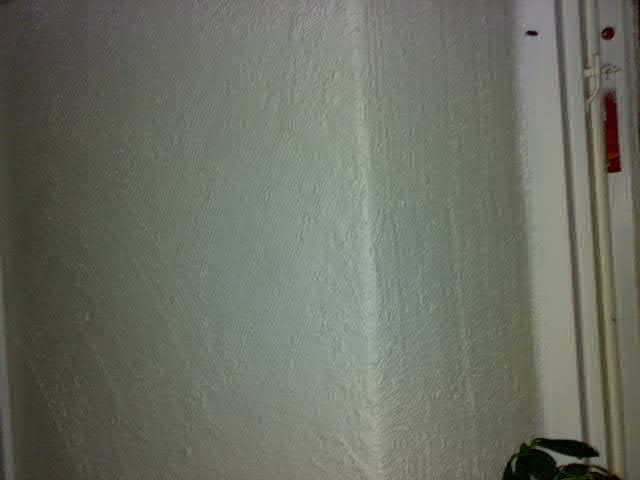
The width and height of the screenshot is (640, 480). What are the coordinates of `circular item on wall` in the screenshot? It's located at point(607,31).